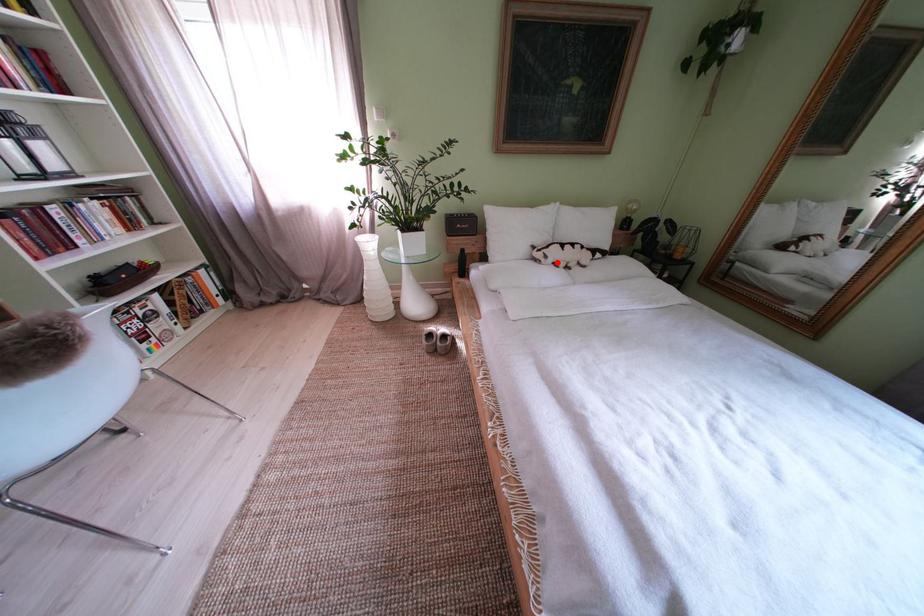
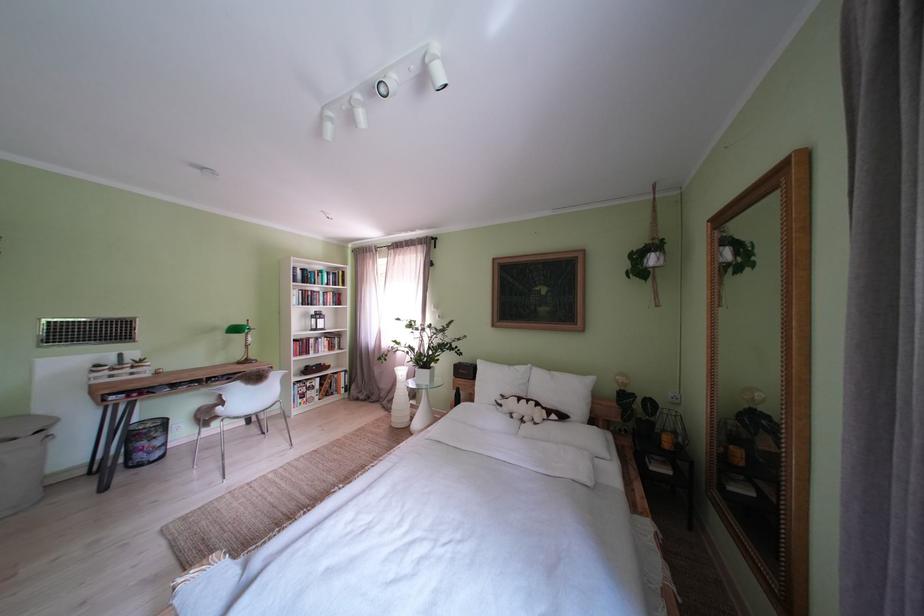
Question: A red point is marked in image1. In image2, is the corresponding 3D point closer to the camera or farther? Reply with the corresponding letter.

Choices:
 (A) The corresponding 3D point is closer.
 (B) The corresponding 3D point is farther.

Answer: (B)